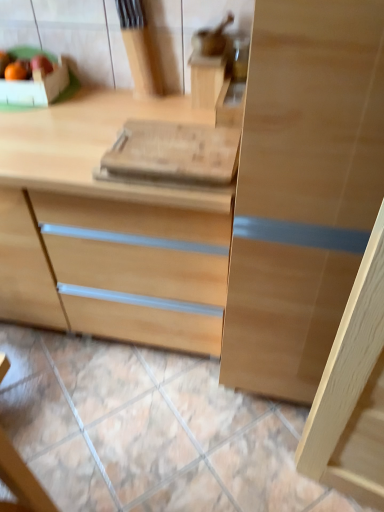
The width and height of the screenshot is (384, 512). What do you see at coordinates (41, 63) in the screenshot?
I see `matte wooden apple at upper left` at bounding box center [41, 63].

What do you see at coordinates (148, 430) in the screenshot? The width and height of the screenshot is (384, 512). I see `natural stone tile at lower center` at bounding box center [148, 430].

Find the location of a particular element. natural wood chest of drawers at center is located at coordinates (x=108, y=230).

From the image's perspective, which is below, matte wooden apple at upper left or natural stone tile at lower center?

natural stone tile at lower center, from the image's perspective.

From a real-world perspective, who is located higher, matte wooden apple at upper left or natural stone tile at lower center?

matte wooden apple at upper left, from a real-world perspective.

Is matte wooden apple at upper left aimed at natural stone tile at lower center?

No, matte wooden apple at upper left is not turned towards natural stone tile at lower center.

Is matte wooden apple at upper left placed right next to natural stone tile at lower center?

No, matte wooden apple at upper left is not touching natural stone tile at lower center.

From a real-world perspective, is natural wood chest of drawers at center over matte wooden apple at upper left?

Actually, natural wood chest of drawers at center is physically below matte wooden apple at upper left in the real world.

Is matte wooden apple at upper left at the back of natural wood chest of drawers at center?

That's not correct — natural wood chest of drawers at center is not looking away from matte wooden apple at upper left.

Is the position of natural wood chest of drawers at center less distant than that of matte wooden apple at upper left?

Yes, natural wood chest of drawers at center is in front of matte wooden apple at upper left.

In terms of size, does natural wood chest of drawers at center appear bigger or smaller than matte wooden apple at upper left?

In the image, natural wood chest of drawers at center appears to be larger than matte wooden apple at upper left.

Is matte wooden apple at upper left bigger than natural wood chest of drawers at center?

No, matte wooden apple at upper left is not bigger than natural wood chest of drawers at center.

Which object is further away from the camera taking this photo, matte wooden apple at upper left or natural wood chest of drawers at center?

matte wooden apple at upper left is more distant.

From a real-world perspective, is matte wooden apple at upper left under natural wood chest of drawers at center?

No, from a real-world perspective, matte wooden apple at upper left is not beneath natural wood chest of drawers at center.

From the image's perspective, is natural wood chest of drawers at center beneath natural stone tile at lower center?

No, from the image's perspective, natural wood chest of drawers at center is not beneath natural stone tile at lower center.

In terms of height, does natural wood chest of drawers at center look taller or shorter compared to natural stone tile at lower center?

natural wood chest of drawers at center is taller than natural stone tile at lower center.

From the picture: Is natural wood chest of drawers at center oriented towards natural stone tile at lower center?

No, natural wood chest of drawers at center does not turn towards natural stone tile at lower center.

Considering the points (60, 316) and (246, 468), which point is behind, point (60, 316) or point (246, 468)?

Positioned behind is point (60, 316).

Does natural stone tile at lower center have a lesser height compared to matte wooden apple at upper left?

Yes, natural stone tile at lower center is shorter than matte wooden apple at upper left.

Is natural stone tile at lower center turned away from matte wooden apple at upper left?

natural stone tile at lower center does not have its back to matte wooden apple at upper left.

Which object is wider, natural stone tile at lower center or matte wooden apple at upper left?

natural stone tile at lower center.

Is natural stone tile at lower center surrounding natural wood chest of drawers at center?

No, natural wood chest of drawers at center is not inside natural stone tile at lower center.

Is point (280, 493) closer to viewer compared to point (83, 194)?

That is False.

Between natural stone tile at lower center and natural wood chest of drawers at center, which one has larger width?

Wider between the two is natural stone tile at lower center.

Considering the sizes of objects natural stone tile at lower center and natural wood chest of drawers at center in the image provided, who is bigger, natural stone tile at lower center or natural wood chest of drawers at center?

natural wood chest of drawers at center is bigger.

At what (x,y) coordinates should I click in order to perform the action: click on fruit above the natural stone tile at lower center (from the image's perspective). Please return your answer as a coordinate pair (x, y). The height and width of the screenshot is (512, 384). Looking at the image, I should click on (41, 63).

Locate an element on the screen. This screenshot has height=512, width=384. the chest of drawers located in front of the matte wooden apple at upper left is located at coordinates (108, 230).

Looking at the image, which one is located further to matte wooden apple at upper left, natural wood chest of drawers at center or natural stone tile at lower center?

natural stone tile at lower center is positioned further to the anchor matte wooden apple at upper left.

Considering their positions, is natural stone tile at lower center positioned further to natural wood chest of drawers at center than matte wooden apple at upper left?

matte wooden apple at upper left is further to natural wood chest of drawers at center.

Based on the photo, looking at the image, which one is located further to natural wood chest of drawers at center, matte wooden apple at upper left or natural stone tile at lower center?

Based on the image, matte wooden apple at upper left appears to be further to natural wood chest of drawers at center.

When comparing their distances from natural stone tile at lower center, does natural wood chest of drawers at center or matte wooden apple at upper left seem closer?

natural wood chest of drawers at center is closer to natural stone tile at lower center.

When comparing their distances from natural stone tile at lower center, does matte wooden apple at upper left or natural wood chest of drawers at center seem closer?

natural wood chest of drawers at center.

Estimate the real-world distances between objects in this image. Which object is further from matte wooden apple at upper left, natural stone tile at lower center or natural wood chest of drawers at center?

natural stone tile at lower center lies further to matte wooden apple at upper left than the other object.

Where is `the chest of drawers between matte wooden apple at upper left and natural stone tile at lower center vertically`? Image resolution: width=384 pixels, height=512 pixels. the chest of drawers between matte wooden apple at upper left and natural stone tile at lower center vertically is located at coordinates (108, 230).